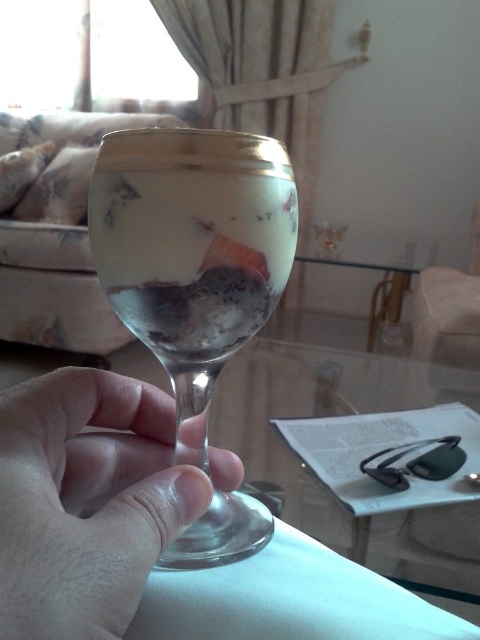
Is transparent glass at lower center wider than translucent glass wine at center?

Yes.

Is point (122, 540) in front of point (263, 266)?

Yes, point (122, 540) is in front of point (263, 266).

Find the location of a particular element. This screenshot has height=640, width=480. transparent glass at lower center is located at coordinates (85, 500).

Which is more to the left, clear glass martini glass at center or transparent glass at lower center?

Positioned to the left is transparent glass at lower center.

Who is lower down, clear glass martini glass at center or transparent glass at lower center?

transparent glass at lower center is below.

At what (x,y) coordinates should I click in order to perform the action: click on clear glass martini glass at center. Please return your answer as a coordinate pair (x, y). The height and width of the screenshot is (640, 480). Looking at the image, I should click on [192, 250].

Which is below, clear glass martini glass at center or translucent glass wine at center?

clear glass martini glass at center

Between point (201, 356) and point (93, 237), which one is positioned in front?

Point (93, 237)

Identify the location of clear glass martini glass at center. The width and height of the screenshot is (480, 640). (192, 250).